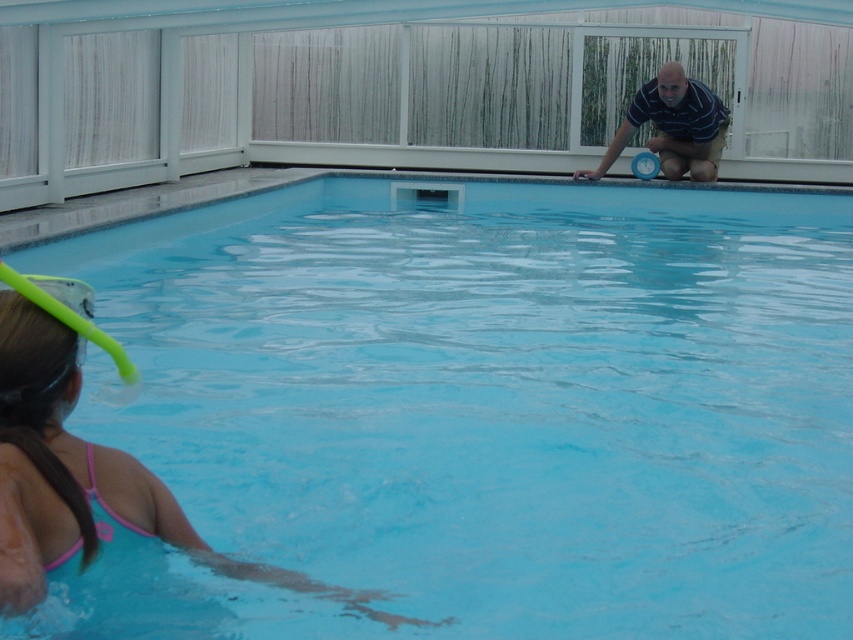
You are a lifeguard standing at the edge of the transparent glass swimming pool at center. You need to retrieve the striped cotton shirt at upper right that belongs to a swimmer. Can you reach it without leaving the pool area?

The transparent glass swimming pool at center is in front of striped cotton shirt at upper right, so the shirt is located behind the pool. Since the pool area is enclosed by a white railing, you cannot reach the shirt without leaving the pool area.